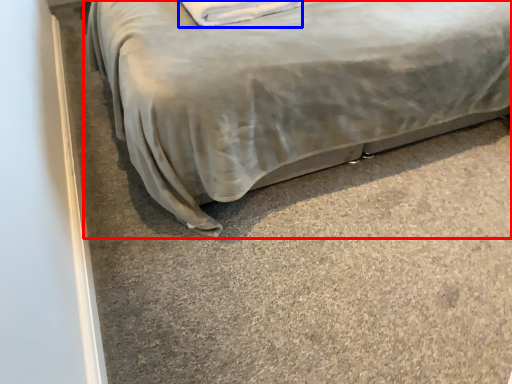
Question: Among these objects, which one is nearest to the camera, bed (highlighted by a red box) or pillow (highlighted by a blue box)?

Choices:
 (A) bed
 (B) pillow

Answer: (A)